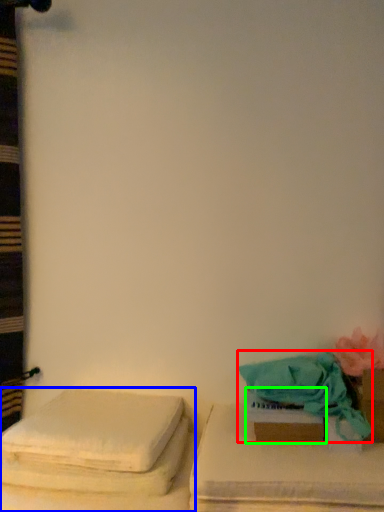
Question: Which object is the closest to the beach towel (highlighted by a red box)? Choose among these: furniture (highlighted by a blue box) or box (highlighted by a green box).

Choices:
 (A) furniture
 (B) box

Answer: (B)